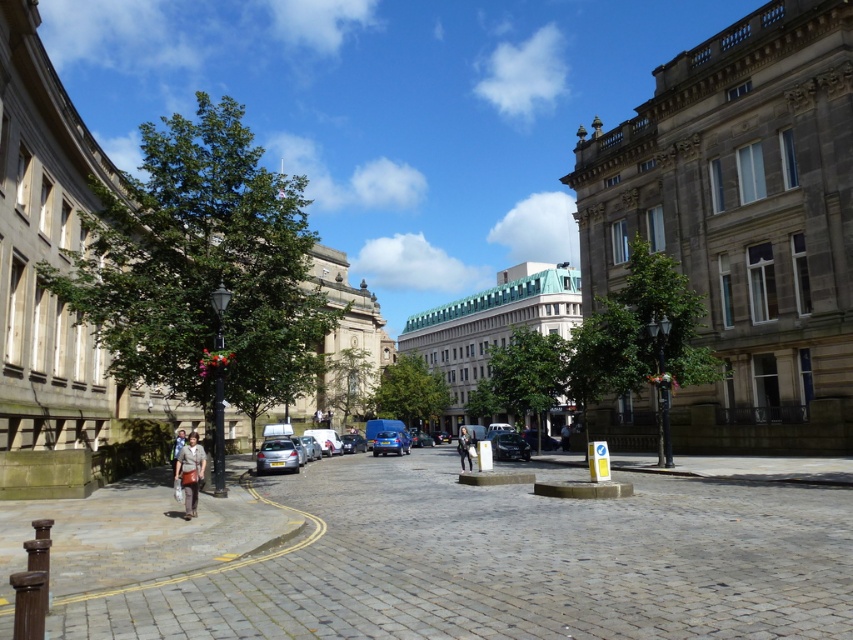
Can you confirm if gray cobblestone pavement at center is positioned below dark gray sweater at center?

No.

Measure the distance between gray cobblestone pavement at center and dark gray sweater at center.

gray cobblestone pavement at center and dark gray sweater at center are 90.92 feet apart from each other.

Identify the location of gray cobblestone pavement at center. The height and width of the screenshot is (640, 853). (440, 557).

The height and width of the screenshot is (640, 853). I want to click on gray cobblestone pavement at center, so click(x=440, y=557).

Does point (378, 448) come in front of point (463, 445)?

That is False.

Locate an element on the screen. The image size is (853, 640). metallic silver car at center is located at coordinates (389, 442).

Is matte brown coat at lower left wider than dark blue jeans at center?

Incorrect, matte brown coat at lower left's width does not surpass dark blue jeans at center's.

Who is positioned more to the right, matte brown coat at lower left or dark blue jeans at center?

From the viewer's perspective, dark blue jeans at center appears more on the right side.

Does point (192, 477) come in front of point (566, 451)?

Yes, point (192, 477) is in front of point (566, 451).

The height and width of the screenshot is (640, 853). What are the coordinates of `matte brown coat at lower left` in the screenshot? It's located at click(190, 472).